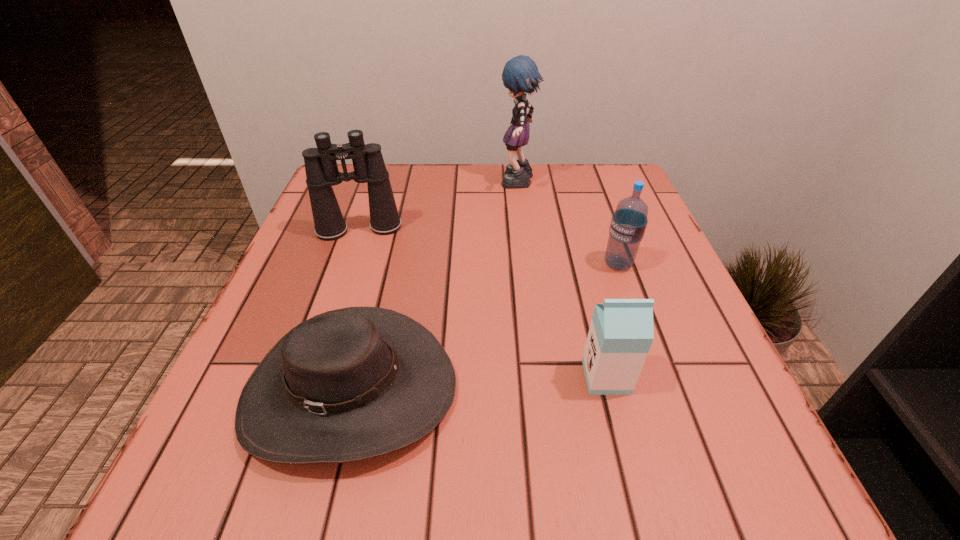
I want to click on object located at the near left corner, so click(x=350, y=384).

Locate an element on the screen. This screenshot has width=960, height=540. vacant area at the left edge is located at coordinates (218, 413).

In the image, there is a desktop. Where is `vacant area at the right edge`? This screenshot has width=960, height=540. vacant area at the right edge is located at coordinates (649, 261).

In the image, there is a desktop. Where is `vacant space at the far left corner`? The width and height of the screenshot is (960, 540). vacant space at the far left corner is located at coordinates (358, 195).

The image size is (960, 540). I want to click on free space at the near left corner of the desktop, so click(200, 495).

Where is `vacant space at the far right corner`? vacant space at the far right corner is located at coordinates (x=594, y=193).

The image size is (960, 540). In the image, there is a desktop. What are the coordinates of `vacant space at the near right corner` in the screenshot? It's located at (762, 488).

The image size is (960, 540). In order to click on blank region between the tallest object and the fourth nearest object in this screenshot , I will do `click(439, 206)`.

Find the location of a particular element. The image size is (960, 540). unoccupied area between the rightmost object and the shortest object is located at coordinates (484, 327).

Where is `free space between the tallest object and the cowboy hat`? The image size is (960, 540). free space between the tallest object and the cowboy hat is located at coordinates (434, 287).